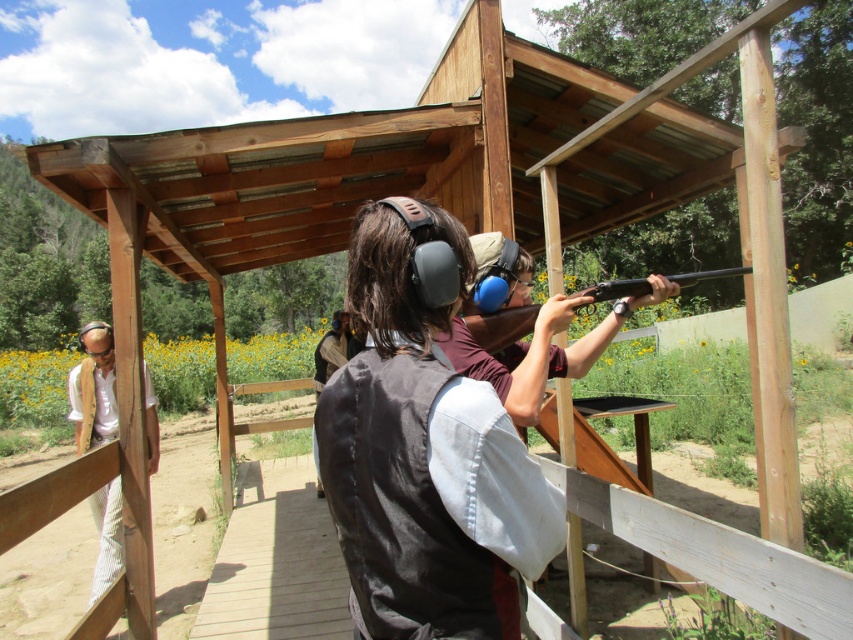
Question: Which point is closer to the camera?

Choices:
 (A) (149, 388)
 (B) (601, 291)

Answer: (B)

Question: Which of the following is the closest to the observer?

Choices:
 (A) matte black shotgun at center
 (B) dark brown leather vest at center

Answer: (B)

Question: Does dark brown leather vest at center have a larger size compared to matte black shotgun at center?

Choices:
 (A) yes
 (B) no

Answer: (B)

Question: Which point is farther to the camera?

Choices:
 (A) white striped pants at left
 (B) matte black shotgun at center

Answer: (A)

Question: Does dark brown leather vest at center appear over matte black shotgun at center?

Choices:
 (A) yes
 (B) no

Answer: (B)

Question: Does white striped pants at left have a smaller size compared to matte black shotgun at center?

Choices:
 (A) no
 (B) yes

Answer: (B)